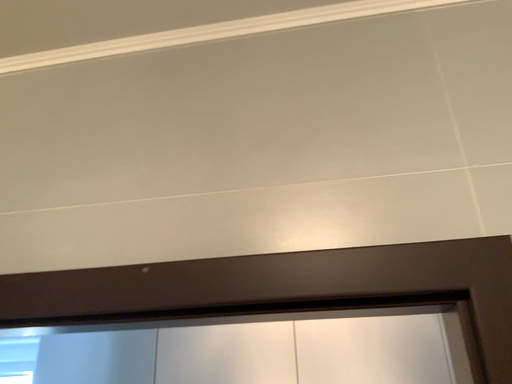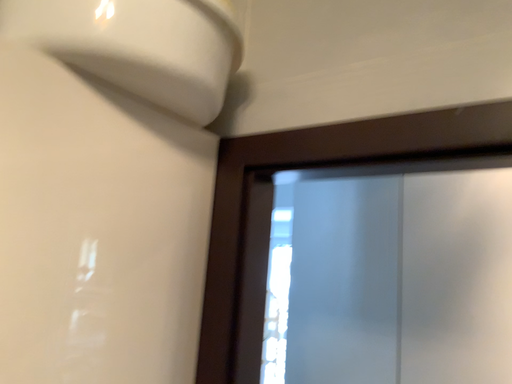
Question: Which way did the camera rotate in the video?

Choices:
 (A) rotated upward
 (B) rotated downward

Answer: (B)